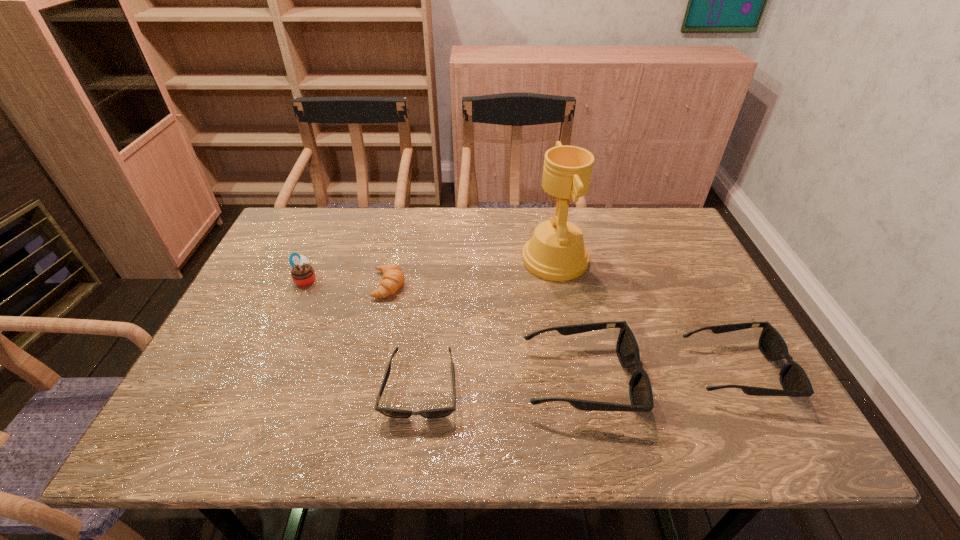
The height and width of the screenshot is (540, 960). I want to click on the leftmost sunglasses, so click(x=389, y=412).

Identify the location of the second sunglasses from left to right. Image resolution: width=960 pixels, height=540 pixels. (640, 391).

This screenshot has width=960, height=540. I want to click on the third shortest object, so click(795, 383).

The width and height of the screenshot is (960, 540). I want to click on the second shortest sunglasses, so click(795, 383).

Find the location of a particular element. The height and width of the screenshot is (540, 960). muffin is located at coordinates (303, 274).

You are a GUI agent. You are given a task and a screenshot of the screen. Output one action in this format:
    pyautogui.click(x=<x>, y=<y>)
    Task: Click on the fifth shortest object
    
    Given the screenshot: What is the action you would take?
    pyautogui.click(x=303, y=274)

Where is `crescent roll`? The width and height of the screenshot is (960, 540). crescent roll is located at coordinates (393, 278).

At what (x,y) coordinates should I click in order to perform the action: click on the tallest object. Please return your answer as a coordinate pair (x, y). This screenshot has height=540, width=960. Looking at the image, I should click on (556, 252).

Identify the location of free space located on the front-facing side of the second sunglasses from left to right. (732, 379).

Find the location of a particular element. This screenshot has height=540, width=960. vacant point located 0.310m on the front-facing side of the muffin is located at coordinates (429, 280).